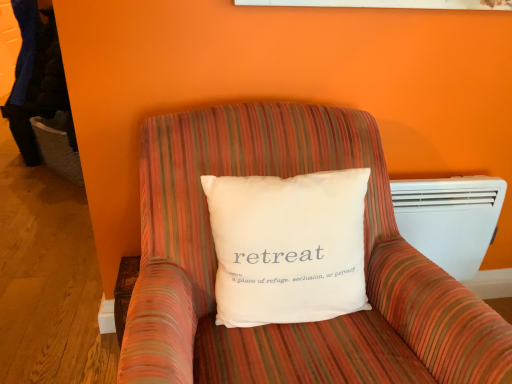
In order to face striped fabric armchair at center, should I rotate leftwards or rightwards?

Rotate right and turn 5.154 degrees.

Describe the element at coordinates (290, 324) in the screenshot. I see `striped fabric armchair at center` at that location.

The image size is (512, 384). In order to click on striped fabric armchair at center in this screenshot , I will do `click(290, 324)`.

Can you confirm if striped fabric armchair at center is taller than white plastic heater at right?

Correct, striped fabric armchair at center is much taller as white plastic heater at right.

Is striped fabric armchair at center closer to the viewer compared to white plastic heater at right?

Yes, striped fabric armchair at center is in front of white plastic heater at right.

From the picture: From a real-world perspective, between striped fabric armchair at center and white plastic heater at right, who is vertically higher?

From a 3D spatial view, striped fabric armchair at center is above.

Which is further, (466,366) or (476,205)?

Point (476,205)

In the scene shown: Is the position of white cotton pillow at center less distant than that of striped fabric armchair at center?

No, white cotton pillow at center is further to the viewer.

Is white cotton pillow at center to the left of striped fabric armchair at center from the viewer's perspective?

Indeed, white cotton pillow at center is positioned on the left side of striped fabric armchair at center.

From the image's perspective, is white cotton pillow at center under striped fabric armchair at center?

Incorrect, from the image's perspective, white cotton pillow at center is higher than striped fabric armchair at center.

In the image, is white cotton pillow at center positioned in front of or behind white plastic heater at right?

In the image, white cotton pillow at center appears in front of white plastic heater at right.

Is white plastic heater at right surrounded by white cotton pillow at center?

No, white plastic heater at right is not surrounded by white cotton pillow at center.

Would you say white cotton pillow at center is a long distance from white plastic heater at right?

white cotton pillow at center is actually quite close to white plastic heater at right.

Which of these two, white plastic heater at right or white cotton pillow at center, is wider?

With larger width is white cotton pillow at center.

Which is behind, point (464, 225) or point (354, 236)?

Positioned behind is point (464, 225).

Between white plastic heater at right and white cotton pillow at center, which one has larger size?

white cotton pillow at center is bigger.

Is white plastic heater at right next to white cotton pillow at center and touching it?

They are not placed beside each other.

Considering the sizes of objects striped fabric armchair at center and white cotton pillow at center in the image provided, who is wider, striped fabric armchair at center or white cotton pillow at center?

Wider between the two is striped fabric armchair at center.

Could you tell me if striped fabric armchair at center is facing white cotton pillow at center?

Yes, striped fabric armchair at center is oriented towards white cotton pillow at center.

Does striped fabric armchair at center have a smaller size compared to white cotton pillow at center?

Actually, striped fabric armchair at center might be larger than white cotton pillow at center.

Identify the location of furniture in front of the white cotton pillow at center. (290, 324).

From the image's perspective, relative to striped fabric armchair at center, is white plastic heater at right above or below?

From the image's perspective, white plastic heater at right appears above striped fabric armchair at center.

Is point (429, 234) in front of point (168, 324)?

No, it is not.

Do you think white plastic heater at right is within striped fabric armchair at center, or outside of it?

white plastic heater at right is spatially situated outside striped fabric armchair at center.

Identify the location of air conditioning on the right of striped fabric armchair at center. The image size is (512, 384). (449, 219).

Identify the location of furniture located underneath the white cotton pillow at center (from a real-world perspective). (290, 324).

Looking at this image, from the image, which object appears to be nearer to white cotton pillow at center, striped fabric armchair at center or white plastic heater at right?

striped fabric armchair at center is closer to white cotton pillow at center.

From the picture: From the image, which object appears to be nearer to white cotton pillow at center, white plastic heater at right or striped fabric armchair at center?

The object closer to white cotton pillow at center is striped fabric armchair at center.

Looking at the image, which one is located closer to striped fabric armchair at center, white cotton pillow at center or white plastic heater at right?

white cotton pillow at center lies closer to striped fabric armchair at center than the other object.

Which object lies further to the anchor point white plastic heater at right, white cotton pillow at center or striped fabric armchair at center?

white cotton pillow at center.

Looking at the image, which one is located closer to striped fabric armchair at center, white plastic heater at right or white cotton pillow at center?

white cotton pillow at center.

Based on the photo, from the image, which object appears to be nearer to white plastic heater at right, striped fabric armchair at center or white cotton pillow at center?

striped fabric armchair at center.

Find the location of a particular element. This screenshot has height=384, width=512. pillow positioned between striped fabric armchair at center and white plastic heater at right from near to far is located at coordinates (288, 246).